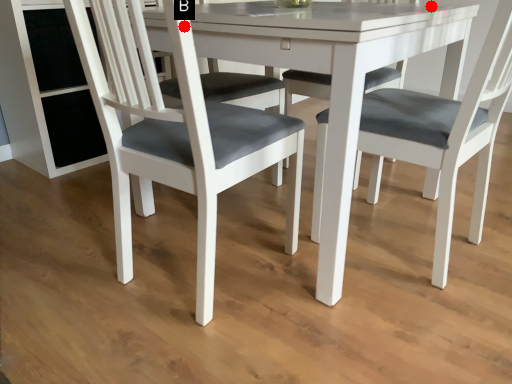
Question: Two points are circled on the image, labeled by A and B beside each circle. Which point is farther to the camera?

Choices:
 (A) A is further
 (B) B is further

Answer: (A)